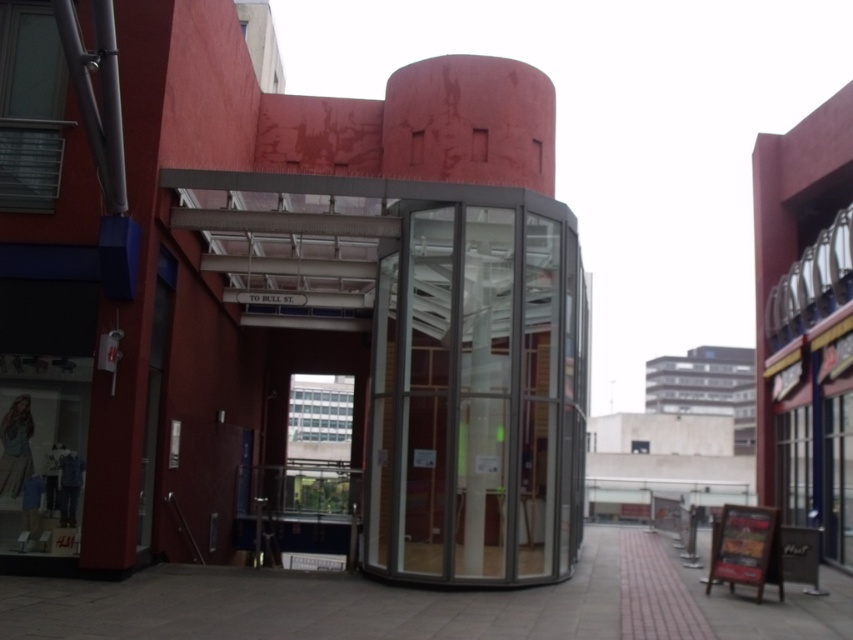
Question: In this image, where is transparent glass elevator at center located relative to paved stone pavement at center?

Choices:
 (A) right
 (B) left

Answer: (B)

Question: Which object is farther from the camera taking this photo?

Choices:
 (A) paved stone pavement at center
 (B) transparent glass elevator at center

Answer: (B)

Question: Does transparent glass elevator at center have a greater width compared to paved stone pavement at center?

Choices:
 (A) no
 (B) yes

Answer: (A)

Question: Does transparent glass elevator at center appear on the left side of paved stone pavement at center?

Choices:
 (A) no
 (B) yes

Answer: (B)

Question: Which of the following is the farthest from the observer?

Choices:
 (A) transparent glass elevator at center
 (B) paved stone pavement at center

Answer: (A)